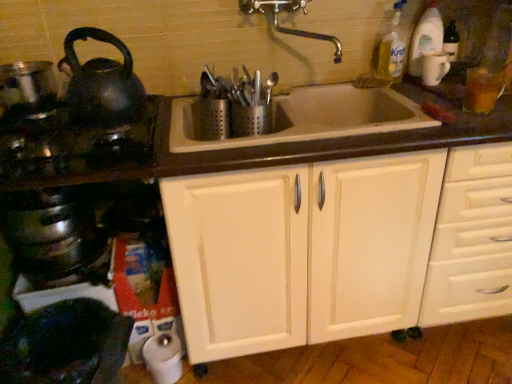
Where is `vacant area that lies between white glossy mug at upper right and yellow plastic bottle at upper right, which appears as the second bottle when viewed from the right`? Image resolution: width=512 pixels, height=384 pixels. vacant area that lies between white glossy mug at upper right and yellow plastic bottle at upper right, which appears as the second bottle when viewed from the right is located at coordinates (407, 82).